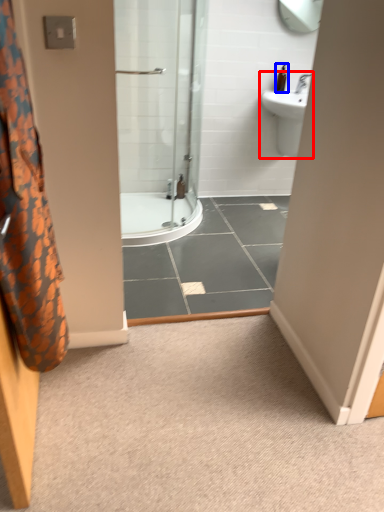
Question: Which of the following is the closest to the observer, sink (highlighted by a red box) or toiletry (highlighted by a blue box)?

Choices:
 (A) sink
 (B) toiletry

Answer: (A)